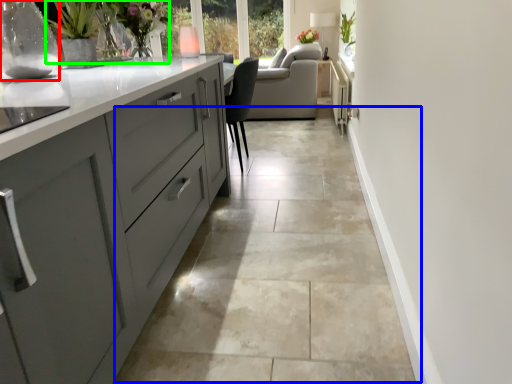
Question: Which is nearer to the glass vase (highlighted by a red box)? concrete (highlighted by a blue box) or floral arrangement (highlighted by a green box).

Choices:
 (A) concrete
 (B) floral arrangement

Answer: (B)